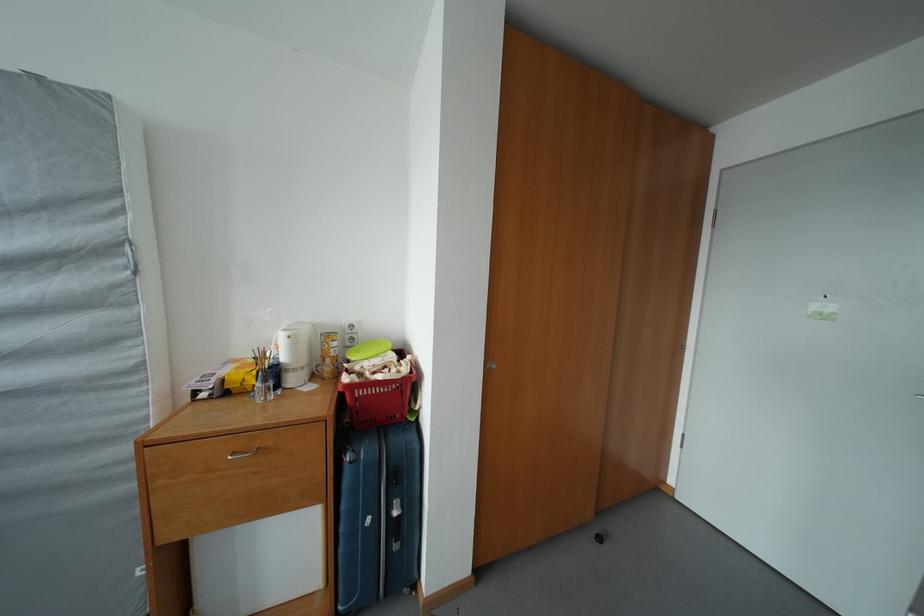
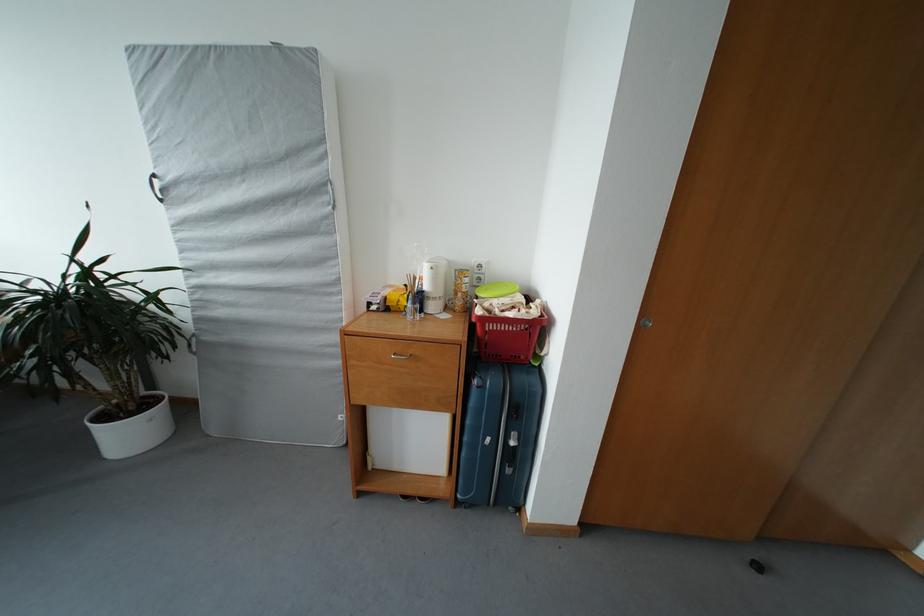
The point at (418, 389) is marked in the first image. Where is the corresponding point in the second image?

(546, 333)